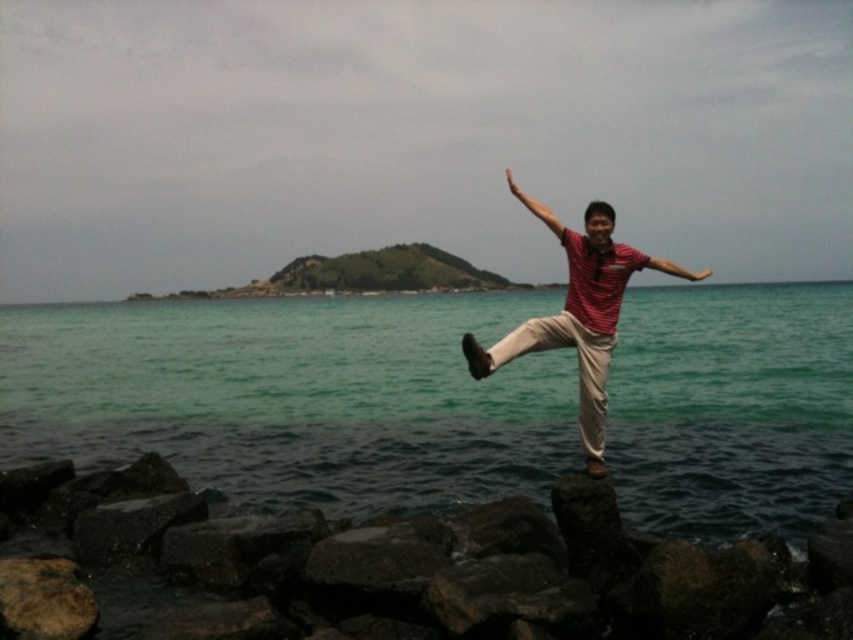
Question: Which object appears farthest from the camera in this image?

Choices:
 (A) red matte arm at upper center
 (B) green water at center

Answer: (A)

Question: Does red striped shirt at center have a greater width compared to red matte arm at upper center?

Choices:
 (A) no
 (B) yes

Answer: (A)

Question: Which object appears closest to the camera in this image?

Choices:
 (A) red matte arm at upper center
 (B) dark gray rock at lower center
 (C) green water at center

Answer: (B)

Question: Is dark gray rock at lower center to the right of red striped shirt at center from the viewer's perspective?

Choices:
 (A) yes
 (B) no

Answer: (B)

Question: Which point is farther to the camera?

Choices:
 (A) (584, 404)
 (B) (354, 616)

Answer: (A)

Question: Does green water at center appear over red matte arm at upper center?

Choices:
 (A) no
 (B) yes

Answer: (A)